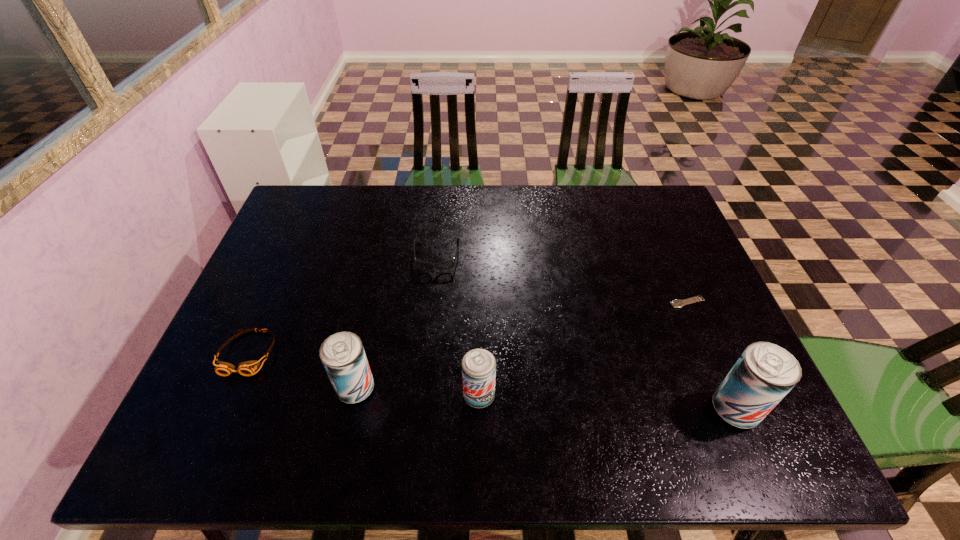
Please determine a free point for an extra beer_can to ensure balance. Please provide its 2D coordinates. Your answer should be formatted as a tuple, i.e. [(x, y)], where the tuple contains the x and y coordinates of a point satisfying the conditions above.

[(606, 402)]